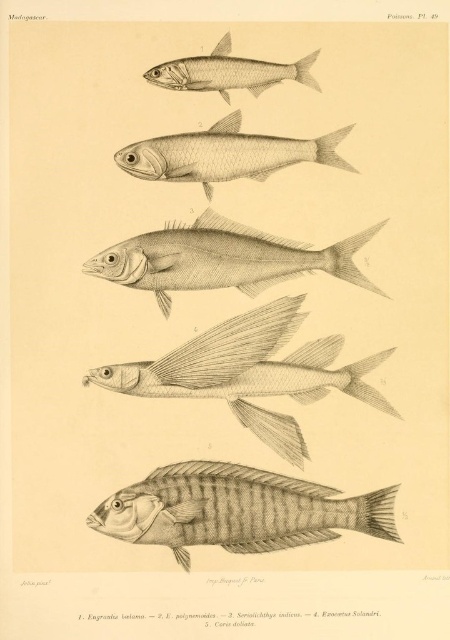
Question: Which point is closer to the camera taking this photo?

Choices:
 (A) (172, 83)
 (B) (212, 538)
 (C) (250, 252)
 (D) (225, 156)

Answer: (B)

Question: Based on their relative distances, which object is nearer to the grayish-white streamlined fish at center?

Choices:
 (A) gray striped fish at lower center
 (B) grayish silver fish at upper center
 (C) grayish silver fish at center

Answer: (A)

Question: Is gray pencil sketch of fish at upper center below grayish-white sketch at center?

Choices:
 (A) no
 (B) yes

Answer: (B)

Question: In this image, where is gray pencil sketch of fish at upper center located relative to grayish-white streamlined fish at center?

Choices:
 (A) below
 (B) above

Answer: (B)

Question: Is grayish-white streamlined fish at center wider than grayish silver fish at center?

Choices:
 (A) yes
 (B) no

Answer: (A)

Question: Which object is positioned farthest from the grayish silver fish at upper center?

Choices:
 (A) gray striped fish at lower center
 (B) grayish-white sketch at center

Answer: (A)